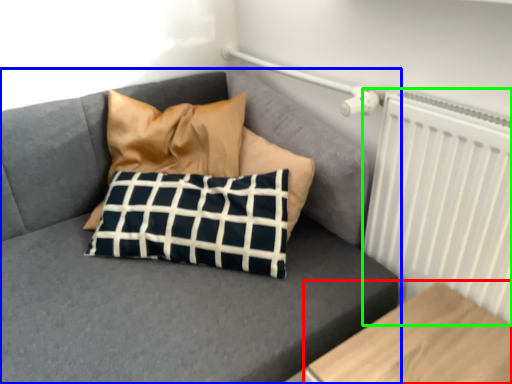
Question: Which is nearer to the furniture (highlighted by a red box)? studio couch (highlighted by a blue box) or radiator (highlighted by a green box).

Choices:
 (A) studio couch
 (B) radiator

Answer: (B)